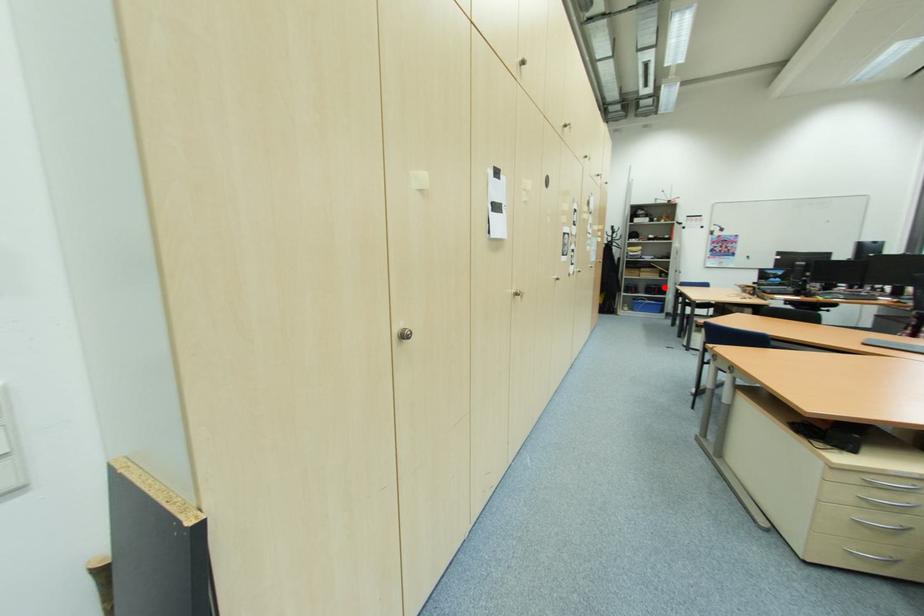
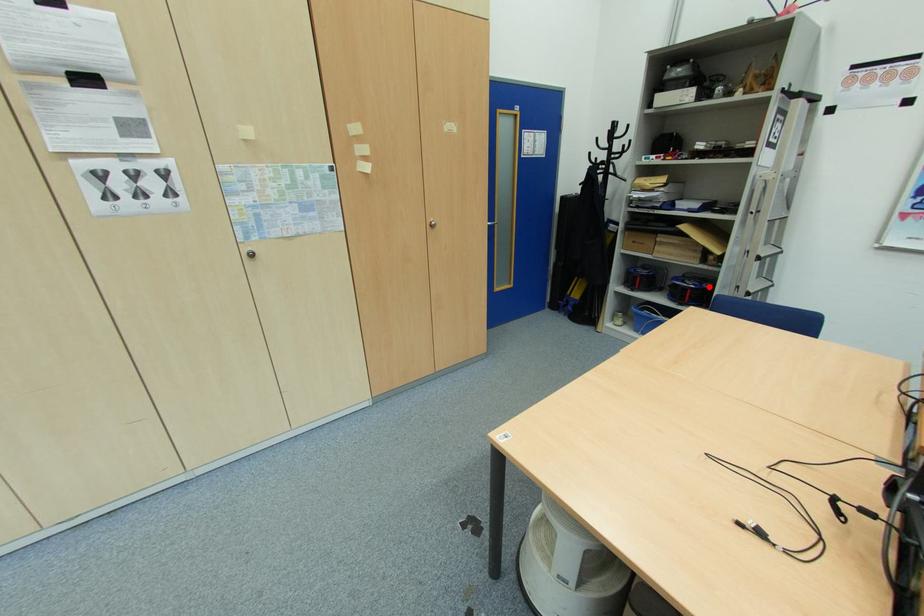
Based on the photo, I am providing you with two images of the same scene from different viewpoints. A red point is marked on the first image and another point is marked on the second image. Are the points marked in image1 and image2 representing the same 3D position?

Yes